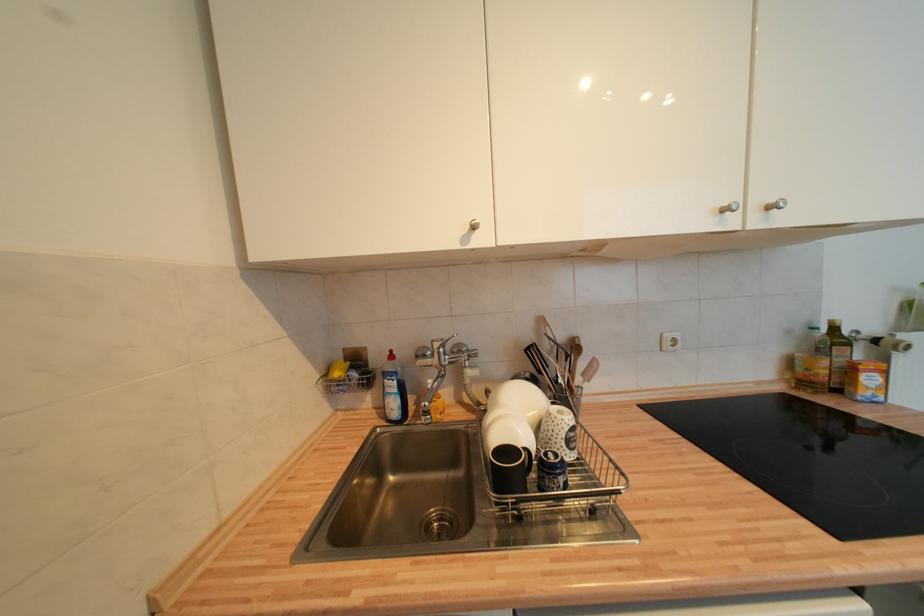
This screenshot has width=924, height=616. Identify the location of wooden utensil handle. (590, 370).